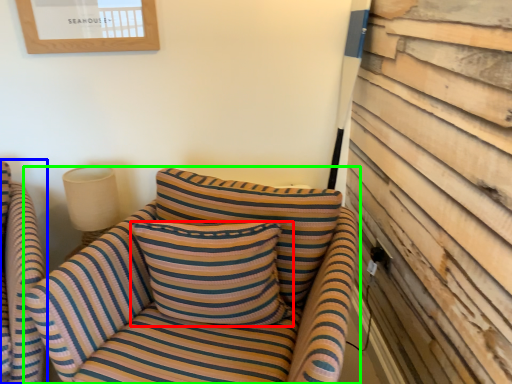
Question: Which object is positioned closest to pillow (highlighted by a red box)? Select from chair (highlighted by a blue box) and studio couch (highlighted by a green box).

Choices:
 (A) chair
 (B) studio couch

Answer: (B)